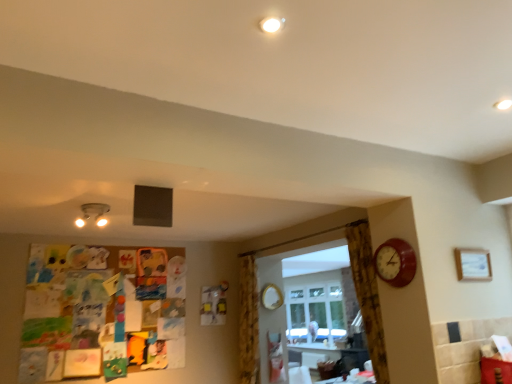
Identify the location of wooden picture frame at upper right. The width and height of the screenshot is (512, 384). (473, 264).

Where is `matte white lamp at upper left`? matte white lamp at upper left is located at coordinates (93, 214).

The width and height of the screenshot is (512, 384). Describe the element at coordinates (367, 294) in the screenshot. I see `brown textured curtain at right, the second curtain when ordered from back to front` at that location.

Find the location of a particular element. This screenshot has width=512, height=384. wooden clock at right is located at coordinates (395, 262).

Image resolution: width=512 pixels, height=384 pixels. Find the location of `yellow floral fabric curtain at center, arranged as the first curtain when viewed from the back`. yellow floral fabric curtain at center, arranged as the first curtain when viewed from the back is located at coordinates (248, 322).

In terms of size, does yellow floral fabric curtain at center, arranged as the first curtain when viewed from the back, appear bigger or smaller than matte white lamp at upper left?

In the image, yellow floral fabric curtain at center, arranged as the first curtain when viewed from the back, appears to be larger than matte white lamp at upper left.

Where is `lamp above the yellow floral fabric curtain at center, the second curtain positioned from the front (from the image's perspective)`? The width and height of the screenshot is (512, 384). lamp above the yellow floral fabric curtain at center, the second curtain positioned from the front (from the image's perspective) is located at coordinates (93, 214).

Is yellow floral fabric curtain at center, which is the 2th curtain in right-to-left order, not close to matte white lamp at upper left?

Absolutely, yellow floral fabric curtain at center, which is the 2th curtain in right-to-left order, is distant from matte white lamp at upper left.

Does yellow floral fabric curtain at center, arranged as the first curtain when viewed from the back, have a lesser width compared to matte white lamp at upper left?

No.

The image size is (512, 384). In the image, there is a gold metallic mirror at center. In order to click on clock above it (from the image's perspective) in this screenshot , I will do `click(395, 262)`.

Can you confirm if gold metallic mirror at center is positioned to the left of wooden clock at right?

Correct, you'll find gold metallic mirror at center to the left of wooden clock at right.

Which of these two, gold metallic mirror at center or wooden clock at right, is thinner?

With smaller width is gold metallic mirror at center.

Considering the positions of objects gold metallic mirror at center and wooden clock at right in the image provided, who is behind, gold metallic mirror at center or wooden clock at right?

gold metallic mirror at center.

Is wooden picture frame at upper right inside or outside of matte white lamp at upper left?

wooden picture frame at upper right exists outside the volume of matte white lamp at upper left.

From a real-world perspective, which is physically below, wooden picture frame at upper right or matte white lamp at upper left?

wooden picture frame at upper right is physically lower.

Is wooden picture frame at upper right thinner than matte white lamp at upper left?

Correct, the width of wooden picture frame at upper right is less than that of matte white lamp at upper left.

Between wooden picture frame at upper right and matte white lamp at upper left, which one is positioned in front?

Positioned in front is wooden picture frame at upper right.

Does gold metallic mirror at center have a smaller size compared to yellow floral fabric curtain at center, the second curtain positioned from the front?

Yes, gold metallic mirror at center is smaller than yellow floral fabric curtain at center, the second curtain positioned from the front.

From a real-world perspective, is gold metallic mirror at center over yellow floral fabric curtain at center, the second curtain positioned from the front?

Correct, in the physical world, gold metallic mirror at center is higher than yellow floral fabric curtain at center, the second curtain positioned from the front.

Is gold metallic mirror at center facing towards yellow floral fabric curtain at center, the second curtain positioned from the front?

No, gold metallic mirror at center is not facing towards yellow floral fabric curtain at center, the second curtain positioned from the front.

In the scene shown: Is matte white lamp at upper left oriented away from wooden picture frame at upper right?

No, matte white lamp at upper left is not facing away from wooden picture frame at upper right.

Considering the relative sizes of matte white lamp at upper left and wooden picture frame at upper right in the image provided, is matte white lamp at upper left shorter than wooden picture frame at upper right?

Yes.

This screenshot has width=512, height=384. In order to click on picture frame in front of the matte white lamp at upper left in this screenshot , I will do `click(473, 264)`.

From the image's perspective, between matte white lamp at upper left and wooden picture frame at upper right, which one is located above?

matte white lamp at upper left is shown above in the image.

Is matte white lamp at upper left far from yellow floral fabric curtain at center, the second curtain positioned from the front?

Yes, matte white lamp at upper left and yellow floral fabric curtain at center, the second curtain positioned from the front, are quite far apart.

How different are the orientations of matte white lamp at upper left and yellow floral fabric curtain at center, the second curtain positioned from the front, in degrees?

The facing directions of matte white lamp at upper left and yellow floral fabric curtain at center, the second curtain positioned from the front, are 91.3 degrees apart.

Identify the location of lamp in front of the yellow floral fabric curtain at center, the second curtain positioned from the front. (93, 214).

Could you measure the distance between matte white lamp at upper left and yellow floral fabric curtain at center, which is the 2th curtain in right-to-left order?

matte white lamp at upper left is 6.29 feet from yellow floral fabric curtain at center, which is the 2th curtain in right-to-left order.

Considering the relative sizes of gold metallic mirror at center and matte white lamp at upper left in the image provided, is gold metallic mirror at center bigger than matte white lamp at upper left?

No.

Who is more distant, gold metallic mirror at center or matte white lamp at upper left?

gold metallic mirror at center is further away from the camera.

This screenshot has height=384, width=512. Identify the location of the 1st curtain counting from the right of the matte white lamp at upper left. (248, 322).

Where is `mirror behind the wooden clock at right`? The image size is (512, 384). mirror behind the wooden clock at right is located at coordinates (271, 297).

Which object lies further to the anchor point wooden clock at right, gold metallic mirror at center or wooden picture frame at upper right?

gold metallic mirror at center.

Based on their spatial positions, is wooden picture frame at upper right or gold metallic mirror at center further from wooden clock at right?

gold metallic mirror at center is positioned further to the anchor wooden clock at right.

Estimate the real-world distances between objects in this image. Which object is further from wooden picture frame at upper right, gold metallic mirror at center or wooden clock at right?

gold metallic mirror at center is positioned further to the anchor wooden picture frame at upper right.

Which object lies nearer to the anchor point brown textured curtain at right, the first curtain positioned from the front, matte white lamp at upper left or wooden clock at right?

wooden clock at right is positioned closer to the anchor brown textured curtain at right, the first curtain positioned from the front.

Considering their positions, is brown textured curtain at right, marked as the 1th curtain in a right-to-left arrangement, positioned closer to gold metallic mirror at center than matte white lamp at upper left?

The object closer to gold metallic mirror at center is brown textured curtain at right, marked as the 1th curtain in a right-to-left arrangement.

Which object lies further to the anchor point yellow floral fabric curtain at center, which is the 2th curtain in right-to-left order, gold metallic mirror at center or matte white lamp at upper left?

The object further to yellow floral fabric curtain at center, which is the 2th curtain in right-to-left order, is matte white lamp at upper left.

Looking at this image, which object lies further to the anchor point brown textured curtain at right, the first curtain positioned from the front, yellow floral fabric curtain at center, the second curtain positioned from the front, or wooden picture frame at upper right?

yellow floral fabric curtain at center, the second curtain positioned from the front, is further to brown textured curtain at right, the first curtain positioned from the front.

Looking at the image, which one is located further to wooden picture frame at upper right, matte white lamp at upper left or brown textured curtain at right, the first curtain positioned from the front?

matte white lamp at upper left is further to wooden picture frame at upper right.

This screenshot has height=384, width=512. I want to click on lamp between wooden clock at right and yellow floral fabric curtain at center, the first curtain viewed from the left, in the front-back direction, so click(93, 214).

The image size is (512, 384). I want to click on clock between matte white lamp at upper left and brown textured curtain at right, acting as the 2th curtain starting from the left, in the horizontal direction, so click(x=395, y=262).

I want to click on curtain positioned between brown textured curtain at right, marked as the 1th curtain in a right-to-left arrangement, and gold metallic mirror at center from near to far, so click(248, 322).

Image resolution: width=512 pixels, height=384 pixels. What are the coordinates of `curtain situated between matte white lamp at upper left and brown textured curtain at right, the first curtain positioned from the front, from left to right` in the screenshot? It's located at (248, 322).